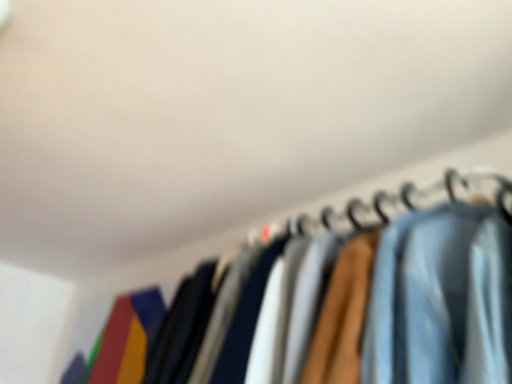
Locate an element on the screen. light blue fabric hanger at center is located at coordinates (393, 205).

What do you see at coordinates (393, 205) in the screenshot?
I see `light blue fabric hanger at center` at bounding box center [393, 205].

Where is `light blue fabric hanger at center`? This screenshot has height=384, width=512. light blue fabric hanger at center is located at coordinates (393, 205).